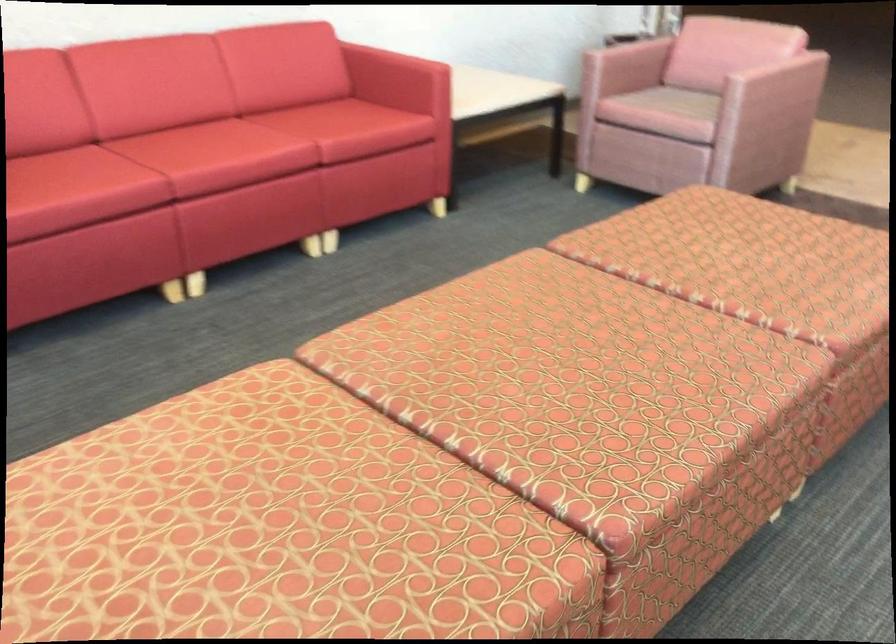
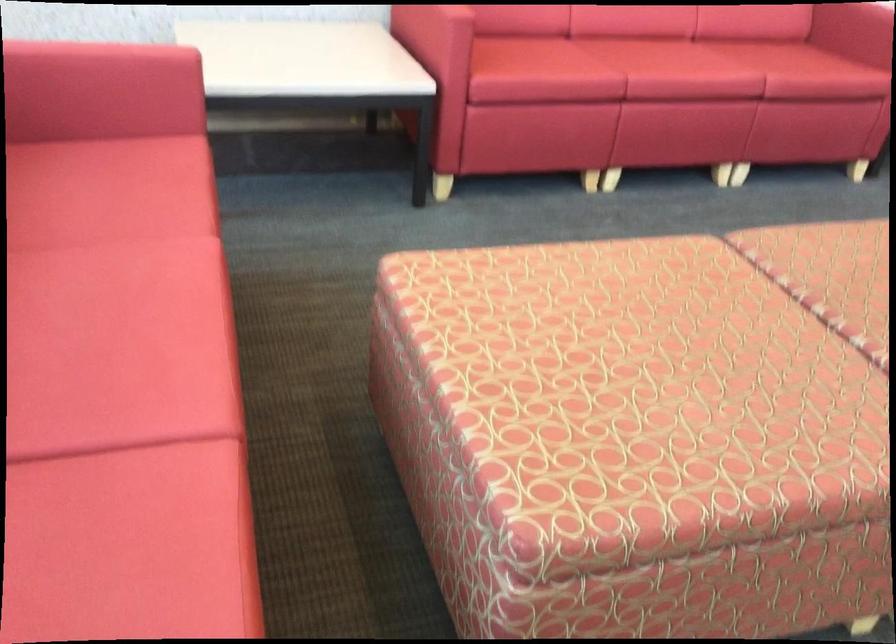
In a continuous first-person perspective shot, in which direction is the camera moving?

The movement direction of the cameraman is left, backward.